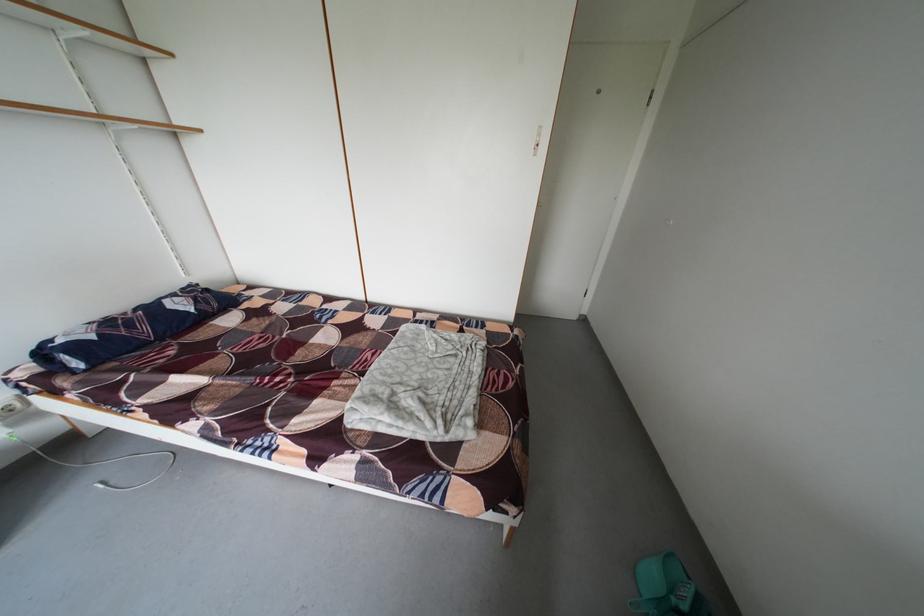
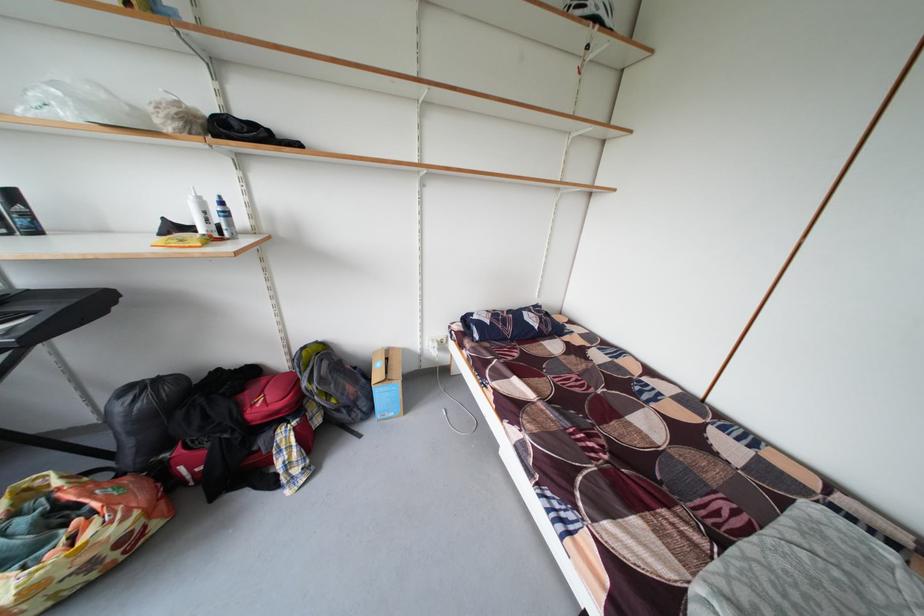
Question: The first image is from the beginning of the video and the second image is from the end. How did the camera likely rotate when shooting the video?

Choices:
 (A) Left
 (B) Right
 (C) Up
 (D) Down

Answer: (A)